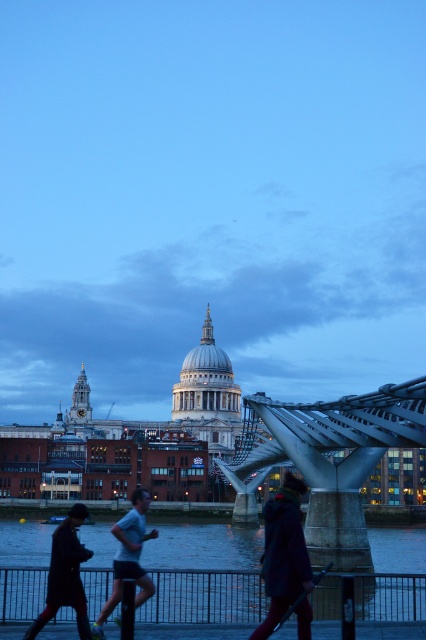
Question: Can you confirm if dark brown leather coat at lower left is positioned to the left of light blue fabric shirt at center?

Choices:
 (A) no
 (B) yes

Answer: (B)

Question: Which of these objects is positioned closest to the dark brown leather coat at lower left?

Choices:
 (A) polished steel suspension bridge at center
 (B) dark blue water at lower center
 (C) velvet purple coat at lower right

Answer: (C)

Question: Based on their relative distances, which object is farther from the velvet purple coat at lower right?

Choices:
 (A) polished steel suspension bridge at center
 (B) dark brown leather coat at lower left
 (C) light blue fabric shirt at center
 (D) dark blue water at lower center

Answer: (D)

Question: Is velvet purple coat at lower right thinner than light blue fabric shirt at center?

Choices:
 (A) no
 (B) yes

Answer: (B)

Question: Does dark blue water at lower center appear under velvet purple coat at lower right?

Choices:
 (A) yes
 (B) no

Answer: (A)

Question: Which point is farther from the camera taking this photo?

Choices:
 (A) (98, 586)
 (B) (138, 536)
 (C) (310, 448)
 (D) (267, 522)

Answer: (C)